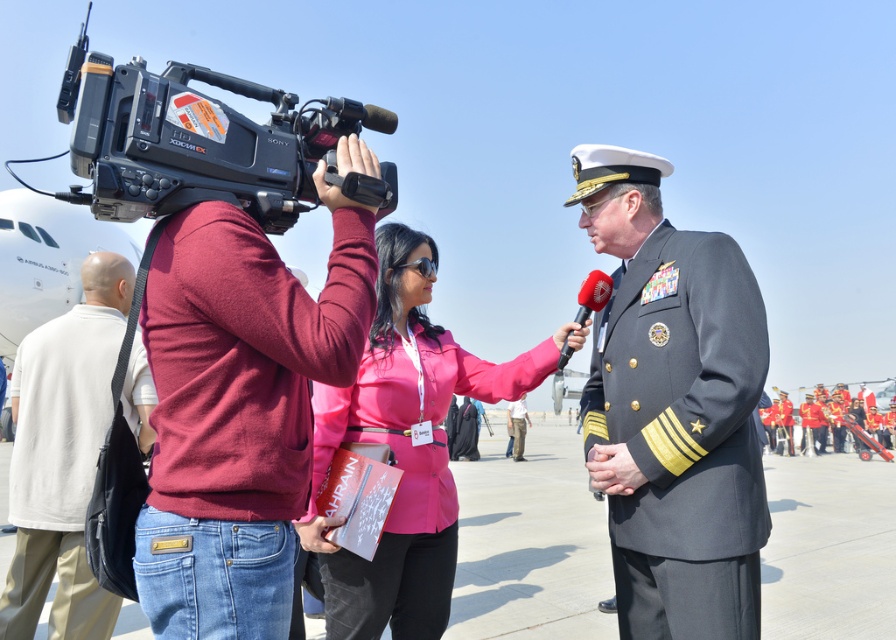
Does pink fabric shirt at center appear on the left side of dark blue fabric uniform at center?

Correct, you'll find pink fabric shirt at center to the left of dark blue fabric uniform at center.

Who is lower down, pink fabric shirt at center or dark blue fabric uniform at center?

Positioned lower is dark blue fabric uniform at center.

Locate an element on the screen. Image resolution: width=896 pixels, height=640 pixels. pink fabric shirt at center is located at coordinates (403, 449).

Is dark gray wool military uniform at center bigger than black plastic video camera at upper left?

Correct, dark gray wool military uniform at center is larger in size than black plastic video camera at upper left.

This screenshot has height=640, width=896. What do you see at coordinates (683, 435) in the screenshot?
I see `dark gray wool military uniform at center` at bounding box center [683, 435].

At what (x,y) coordinates should I click in order to perform the action: click on dark gray wool military uniform at center. Please return your answer as a coordinate pair (x, y). Looking at the image, I should click on (683, 435).

Can you confirm if pink fabric shirt at center is positioned to the right of black plastic video camera at upper left?

Yes, pink fabric shirt at center is to the right of black plastic video camera at upper left.

Does point (365, 392) lie in front of point (298, 150)?

That is False.

Does point (442, 593) lie behind point (239, 148)?

Yes, point (442, 593) is farther from viewer.

At what (x,y) coordinates should I click in order to perform the action: click on pink fabric shirt at center. Please return your answer as a coordinate pair (x, y). The image size is (896, 640). Looking at the image, I should click on (403, 449).